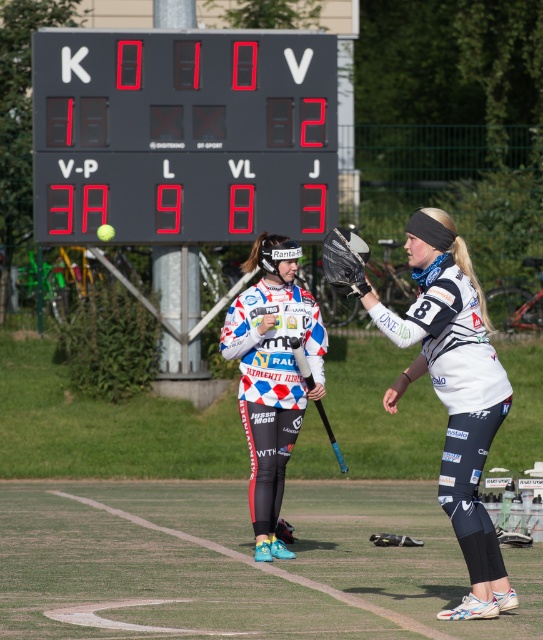
You are a softball coach observing the field. You notice the white matte jersey at center and the blue rubber hockey bat at center. Which object is taller?

The white matte jersey at center is much taller than the blue rubber hockey bat at center.